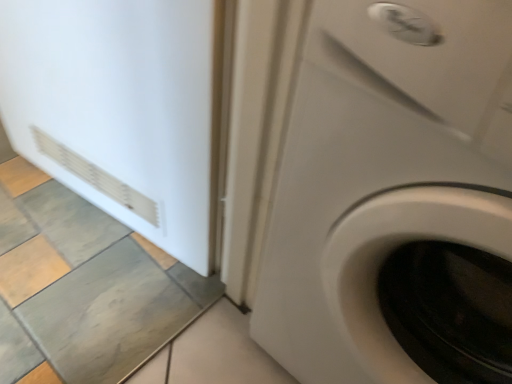
Question: From the image's perspective, is white glossy washing machine at center located above or below white matte refrigerator at left?

Choices:
 (A) below
 (B) above

Answer: (A)

Question: Is white glossy washing machine at center situated inside white matte refrigerator at left or outside?

Choices:
 (A) outside
 (B) inside

Answer: (A)

Question: In the image, is white glossy washing machine at center positioned in front of or behind white matte refrigerator at left?

Choices:
 (A) behind
 (B) front

Answer: (B)

Question: In terms of height, does white matte refrigerator at left look taller or shorter compared to white glossy washing machine at center?

Choices:
 (A) tall
 (B) short

Answer: (B)

Question: From the image's perspective, is white matte refrigerator at left positioned above or below white glossy washing machine at center?

Choices:
 (A) above
 (B) below

Answer: (A)

Question: Would you say white matte refrigerator at left is to the left or to the right of white glossy washing machine at center in the picture?

Choices:
 (A) right
 (B) left

Answer: (B)

Question: Is white matte refrigerator at left wider or thinner than white glossy washing machine at center?

Choices:
 (A) wide
 (B) thin

Answer: (B)